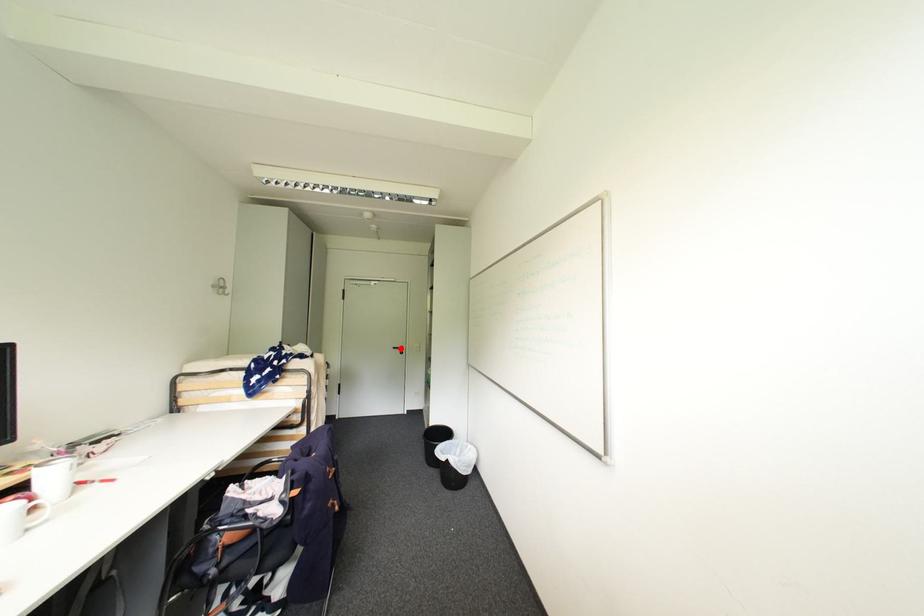
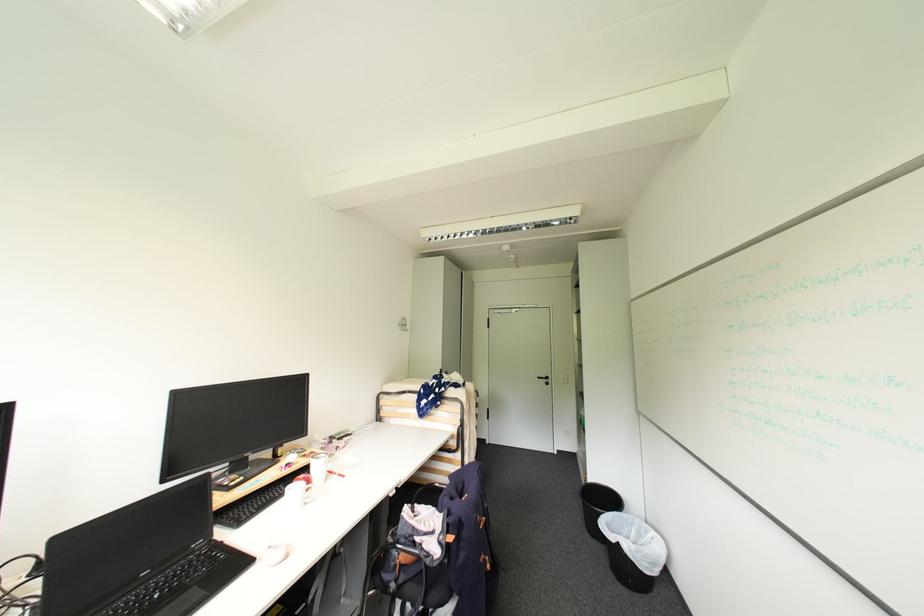
Find the pixel in the second image that matches the highlighted location in the first image.

(544, 379)